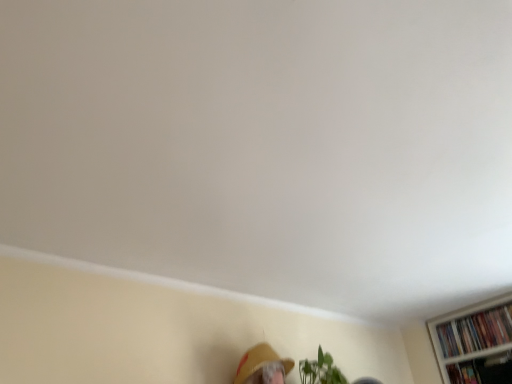
Question: Is matte yellow hat at lower center taller or shorter than multicolored paperbacks at upper right, the 2th book viewed from the front?

Choices:
 (A) tall
 (B) short

Answer: (B)

Question: Considering the positions of matte yellow hat at lower center and multicolored paperbacks at upper right, the first book positioned from the back, in the image, is matte yellow hat at lower center bigger or smaller than multicolored paperbacks at upper right, the first book positioned from the back,?

Choices:
 (A) big
 (B) small

Answer: (A)

Question: Estimate the real-world distances between objects in this image. Which object is farther from the multicolored paperbacks at upper right, the 2th book viewed from the front?

Choices:
 (A) matte yellow hat at lower center
 (B) black matte bookshelf at lower right, the 2th book viewed from the back

Answer: (A)

Question: Based on their relative distances, which object is farther from the black matte bookshelf at lower right, positioned as the 1th book in front-to-back order?

Choices:
 (A) matte yellow hat at lower center
 (B) multicolored paperbacks at upper right, the first book positioned from the back

Answer: (A)